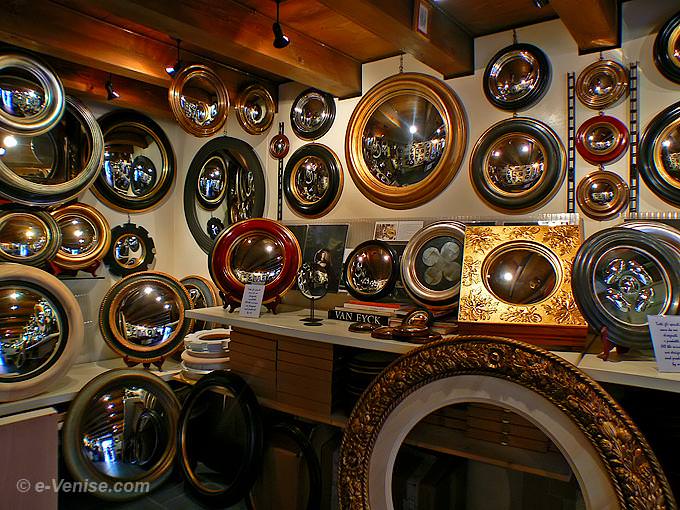
Find the location of a particular element. This screenshot has width=680, height=510. mirror frame is located at coordinates (472, 312), (476, 350).